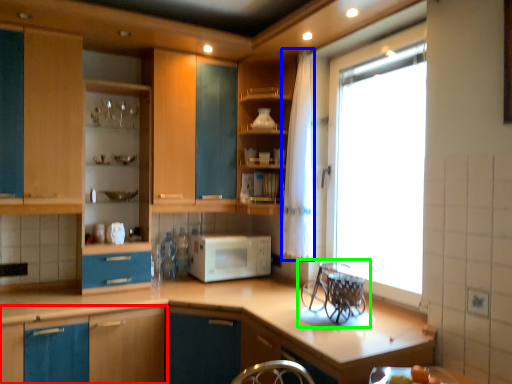
Question: Which object is positioned farthest from cabinetry (highlighted by a red box)? Select from curtain (highlighted by a blue box) and appliance (highlighted by a green box).

Choices:
 (A) curtain
 (B) appliance

Answer: (A)